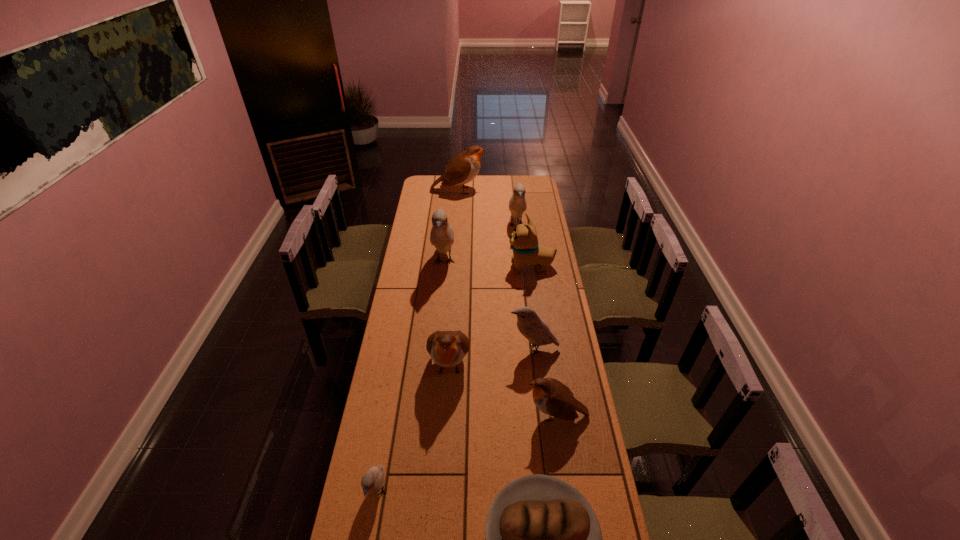
This screenshot has width=960, height=540. What are the coordinates of `vacant space located 0.170m at the beak of the third farthest white bird` in the screenshot? It's located at (468, 348).

The height and width of the screenshot is (540, 960). Find the location of `free space located at the beak of the third farthest white bird`. free space located at the beak of the third farthest white bird is located at coordinates (442, 348).

Locate an element on the screen. The height and width of the screenshot is (540, 960). blank space located at the beak of the third farthest white bird is located at coordinates (449, 348).

Identify the location of vacant space located 0.390m at the face of the second nearest bird. The image size is (960, 540). (418, 415).

Locate an element on the screen. The width and height of the screenshot is (960, 540). vacant space located at the face of the second nearest bird is located at coordinates (464, 415).

Locate an element on the screen. Image resolution: width=960 pixels, height=540 pixels. vacant space located at the face of the second nearest bird is located at coordinates (491, 415).

This screenshot has width=960, height=540. Identify the location of object at the far edge. (463, 168).

Where is `puppy that is at the right edge`? puppy that is at the right edge is located at coordinates (523, 241).

This screenshot has height=540, width=960. Identify the location of object that is at the far left corner. (463, 168).

Where is `free space at the left edge`? The height and width of the screenshot is (540, 960). free space at the left edge is located at coordinates (380, 380).